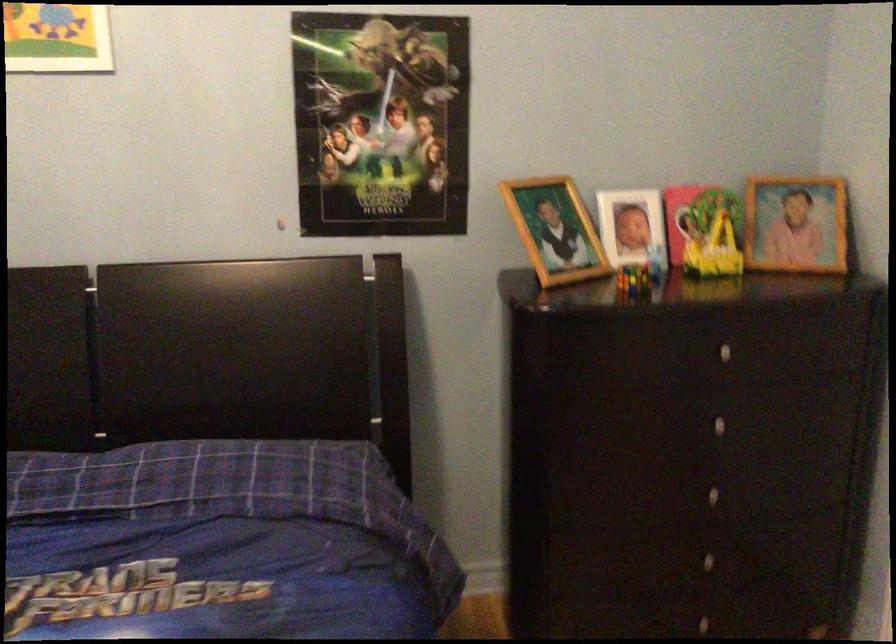
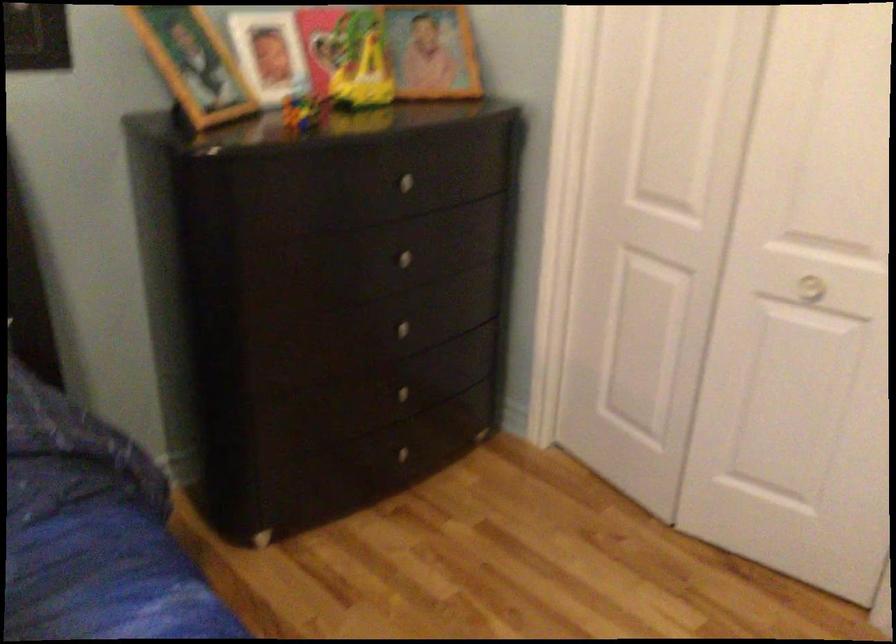
Locate, in the second image, the point that corresponds to [728,345] in the first image.

(408, 178)